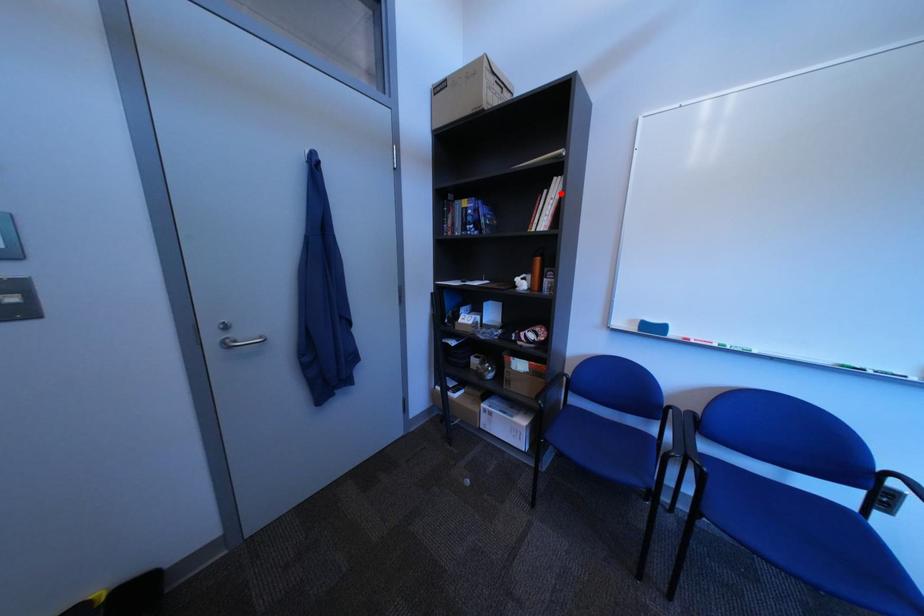
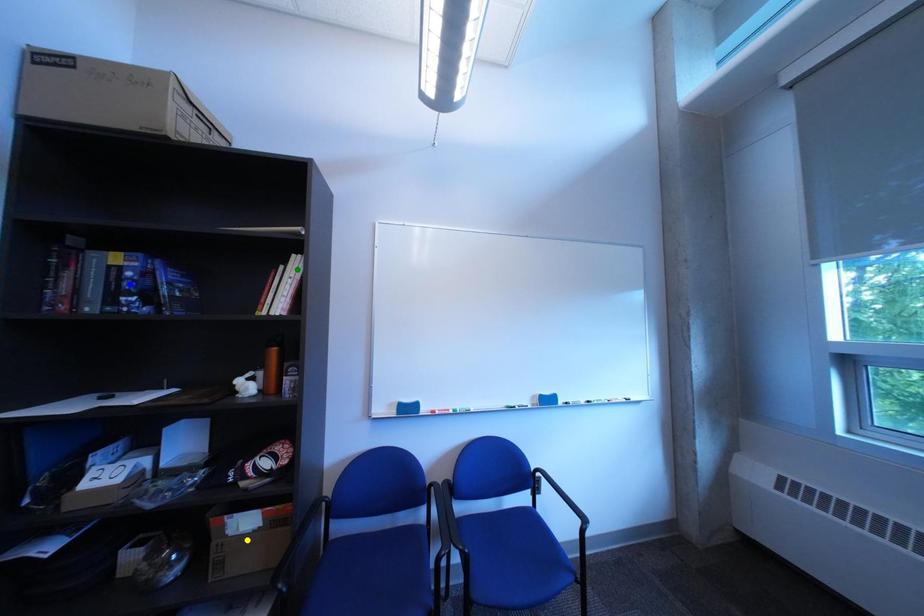
Question: I am providing you with two images of the same scene from different viewpoints. A red point is marked on the first image. You are given multiple points on the second image. Which point in image 2 represents the same 3d spot as the red point in image 1?

Choices:
 (A) green point
 (B) yellow point
 (C) blue point

Answer: (A)